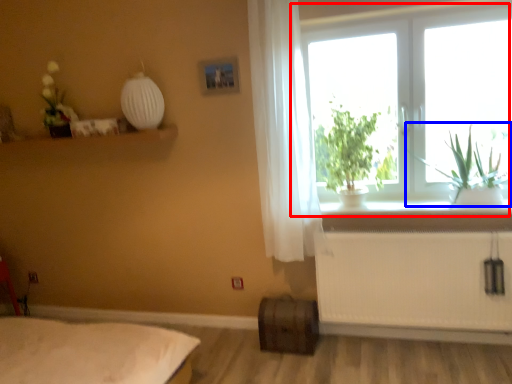
Question: Which point is further to the camera, window (highlighted by a red box) or plant (highlighted by a blue box)?

Choices:
 (A) window
 (B) plant

Answer: (A)